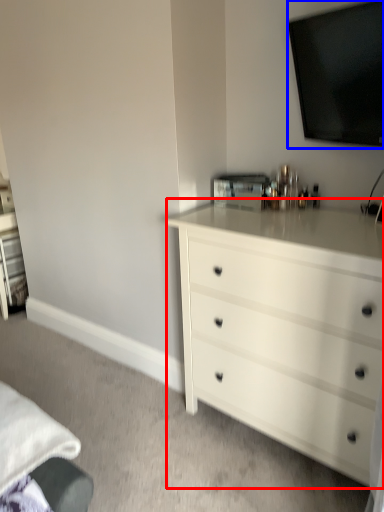
Question: Among these objects, which one is farthest to the camera, chest of drawers (highlighted by a red box) or television (highlighted by a blue box)?

Choices:
 (A) chest of drawers
 (B) television

Answer: (B)